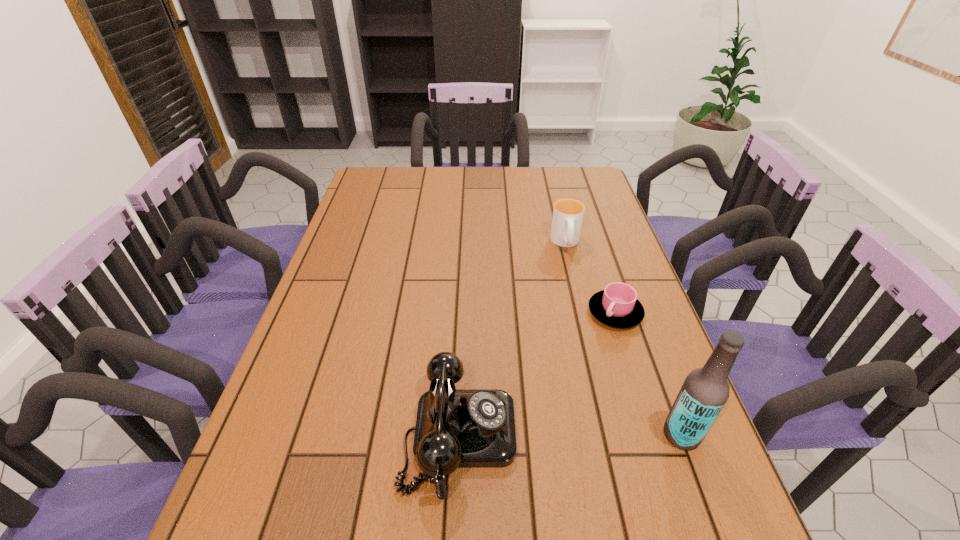
Locate an element on the screen. free point located 0.250m on the side with the handle of the shortest object is located at coordinates (595, 412).

The image size is (960, 540). I want to click on free point located 0.210m on the side with the handle of the shortest object, so click(x=598, y=397).

Image resolution: width=960 pixels, height=540 pixels. What are the coordinates of `blank area located 0.120m on the side with the handle of the shortest object` in the screenshot? It's located at (605, 367).

The height and width of the screenshot is (540, 960). Identify the location of vacant space located 0.260m with the handle on the side of the farthest object. (578, 318).

Where is `vacant space positioned with the handle on the side of the farthest object`? vacant space positioned with the handle on the side of the farthest object is located at coordinates point(574,292).

Find the location of `vacant point located 0.090m with the handle on the side of the farthest object`. vacant point located 0.090m with the handle on the side of the farthest object is located at coordinates (571, 276).

Where is `object located at the near edge`? object located at the near edge is located at coordinates (455, 428).

The image size is (960, 540). I want to click on beer bottle positioned at the right edge, so click(x=705, y=391).

In the image, there is a desktop. Identify the location of vacant area at the far edge. This screenshot has height=540, width=960. (521, 193).

The width and height of the screenshot is (960, 540). Find the location of `blank area at the near edge`. blank area at the near edge is located at coordinates (365, 499).